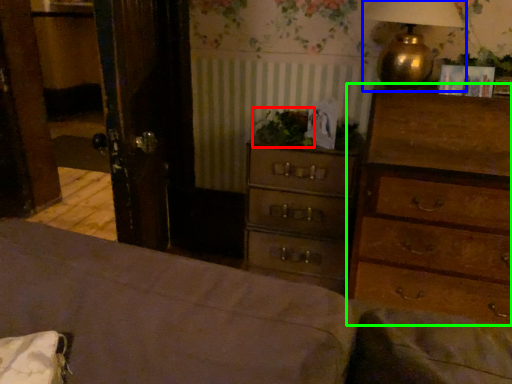
Question: Based on their relative distances, which object is farther from plant (highlighted by a red box)? Choose from table lamp (highlighted by a blue box) and chest of drawers (highlighted by a green box).

Choices:
 (A) table lamp
 (B) chest of drawers

Answer: (B)